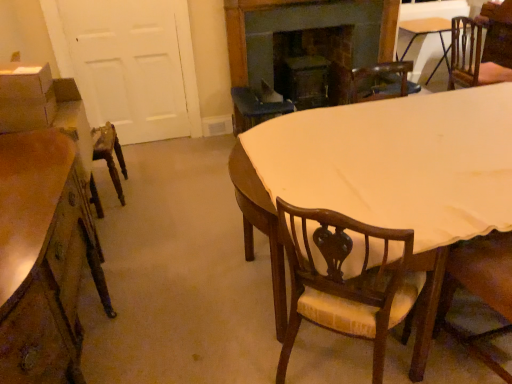
Question: Is white matte door at left positioned with its back to dark wood fireplace at upper center?

Choices:
 (A) no
 (B) yes

Answer: (A)

Question: Is dark wood fireplace at upper center completely or partially inside white matte door at left?

Choices:
 (A) yes
 (B) no

Answer: (B)

Question: Is white matte door at left not within dark wood fireplace at upper center?

Choices:
 (A) no
 (B) yes

Answer: (B)

Question: Considering the relative sizes of white matte door at left and dark wood fireplace at upper center in the image provided, is white matte door at left bigger than dark wood fireplace at upper center?

Choices:
 (A) yes
 (B) no

Answer: (B)

Question: From a real-world perspective, is white matte door at left positioned over dark wood fireplace at upper center based on gravity?

Choices:
 (A) yes
 (B) no

Answer: (A)

Question: Can you confirm if white matte door at left is positioned to the left of dark wood fireplace at upper center?

Choices:
 (A) no
 (B) yes

Answer: (B)

Question: Does matte cardboard box at left come in front of wooden chair with upholstered seat at center, the second chair in the back-to-front sequence?

Choices:
 (A) no
 (B) yes

Answer: (A)

Question: Is matte cardboard box at left bigger than wooden chair with upholstered seat at center, which is counted as the first chair, starting from the left?

Choices:
 (A) no
 (B) yes

Answer: (A)

Question: Does matte cardboard box at left turn towards wooden chair with upholstered seat at center, which is the 2th chair in front-to-back order?

Choices:
 (A) no
 (B) yes

Answer: (A)

Question: Considering the relative positions of matte cardboard box at left and wooden chair with upholstered seat at center, which appears as the 3th chair when viewed from the top, in the image provided, is matte cardboard box at left to the left of wooden chair with upholstered seat at center, which appears as the 3th chair when viewed from the top, from the viewer's perspective?

Choices:
 (A) no
 (B) yes

Answer: (B)

Question: Is matte cardboard box at left touching wooden chair with upholstered seat at center, which is the 2th chair in front-to-back order?

Choices:
 (A) yes
 (B) no

Answer: (B)

Question: From the image's perspective, is matte cardboard box at left below wooden chair with upholstered seat at center, marked as the 3th chair in a right-to-left arrangement?

Choices:
 (A) no
 (B) yes

Answer: (A)

Question: Is light brown wooden table at center not close to dark wood fireplace at upper center?

Choices:
 (A) yes
 (B) no

Answer: (A)